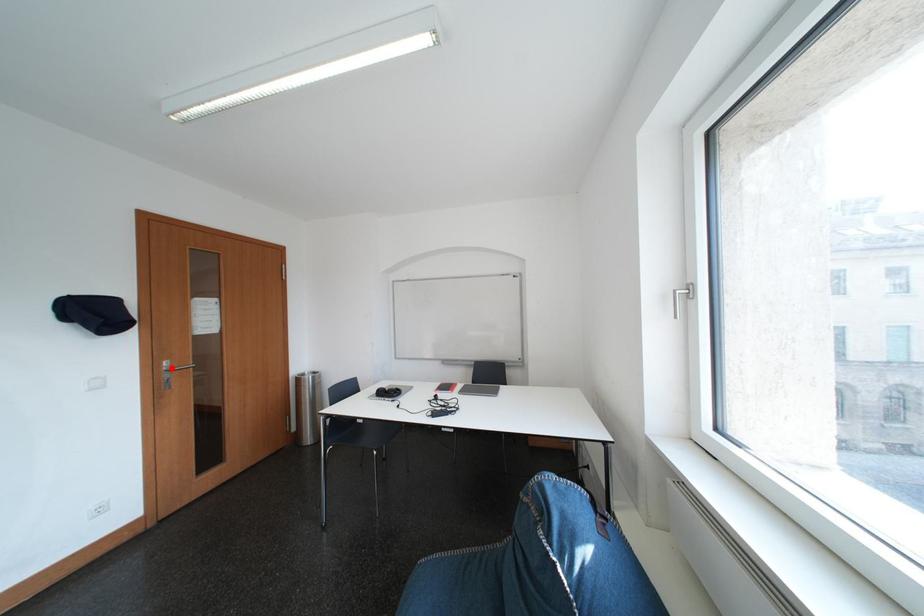
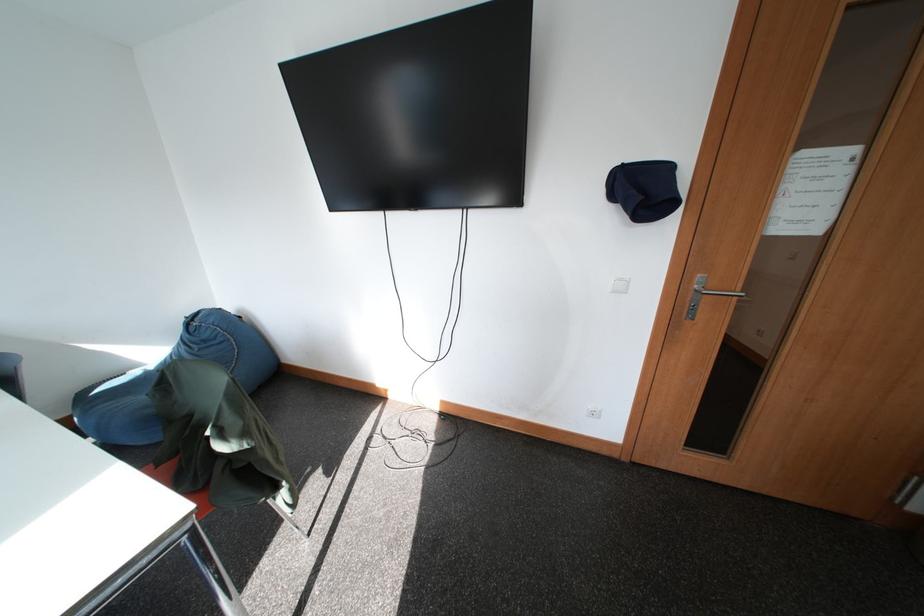
Question: I am providing you with two images of the same scene from different viewpoints. A red point is marked on the first image. At the location where the point appears in image 1, is it still visible in image 2?

Choices:
 (A) Yes
 (B) No

Answer: (A)